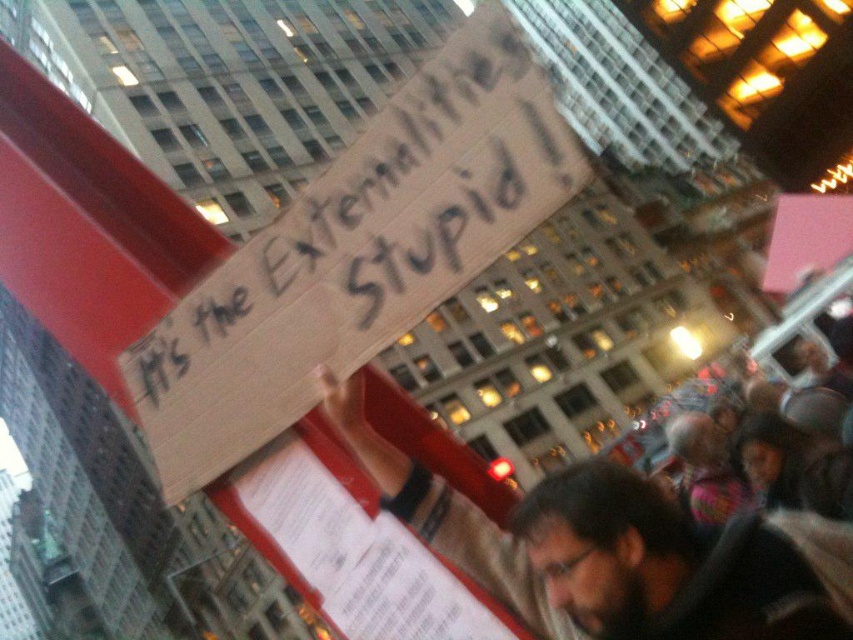
You are a photographer trying to capture the protestor holding the sign. The handwritten cardboard sign at center and dark brown hair at center are both in your viewfinder. Which object should you focus on to ensure the sign is clearly visible?

The handwritten cardboard sign at center is in front of dark brown hair at center, so focusing on the sign will ensure it appears clearly in the photo.

You are a drone operator tasked with capturing aerial footage of the protest scene. Your drone is currently positioned at point A, which is at coordinates point A at (x=440, y=170). You need to fly it to point B, which is 13.73 meters away from point A. Given the urban environment described, what is the minimum altitude your drone must maintain to safely navigate between these two points without colliding with any buildings?

The minimum altitude your drone must maintain to safely navigate between point A at (x=440, y=170) and point B, which is 13.73 meters away, is determined by the height of the nearest buildings. Since the scene includes dense clusters of tall buildings with lit windows, the drone should ascend above the tallest building in the immediate vicinity to ensure safe passage. However, without specific building height data, the safest approach is to maintain an altitude higher than the tallest observed structures, as